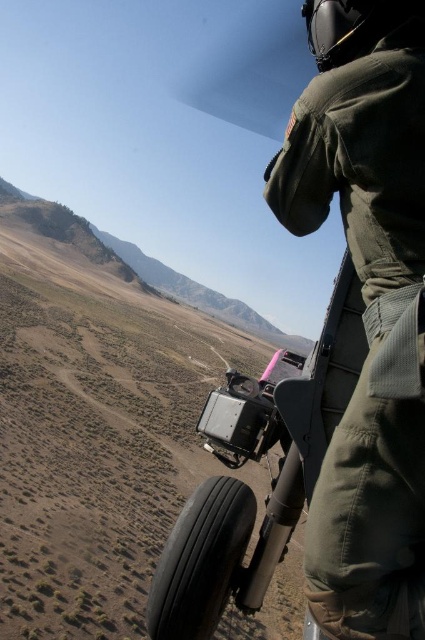
Who is shorter, green fabric uniform at upper right or black rubber tire at lower center?

With less height is black rubber tire at lower center.

Which is more to the left, green fabric uniform at upper right or black rubber tire at lower center?

black rubber tire at lower center

Between point (380, 288) and point (184, 508), which one is positioned behind?

The point (184, 508) is behind.

Locate an element on the screen. This screenshot has width=425, height=640. green fabric uniform at upper right is located at coordinates (367, 307).